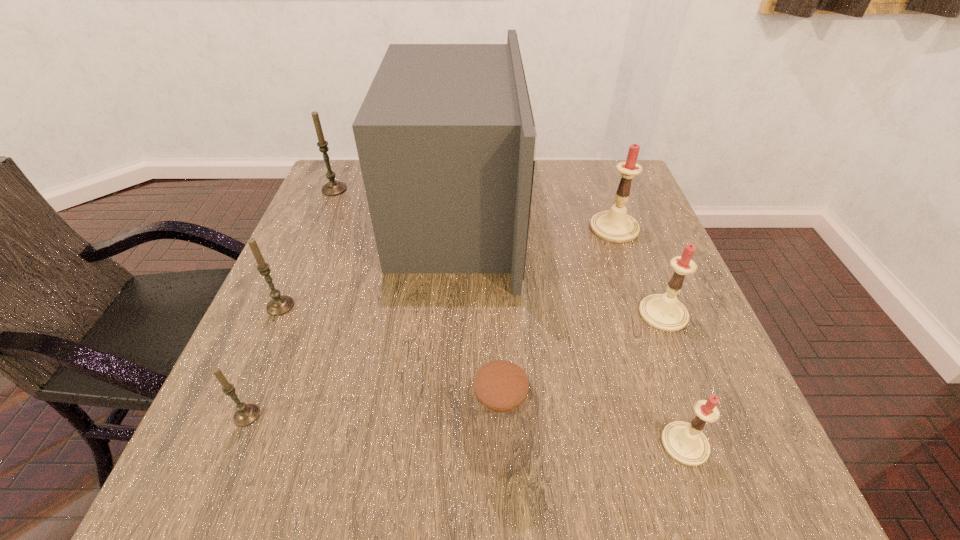
The width and height of the screenshot is (960, 540). What are the coordinates of `candle that stands as the closest to the microwave oven` in the screenshot? It's located at (332, 188).

Select which candle appears as the closest to the nearest red candle. Please provide its 2D coordinates. Your answer should be formatted as a tuple, i.e. [(x, y)], where the tuple contains the x and y coordinates of a point satisfying the conditions above.

[(664, 312)]

Find the location of a particular element. The image size is (960, 540). gray candle object that ranks as the second closest to the smallest gray candle is located at coordinates (332, 188).

Where is `gray candle that stands as the third closest to the microwave oven`? This screenshot has height=540, width=960. gray candle that stands as the third closest to the microwave oven is located at coordinates (246, 414).

Identify which red candle is located as the third nearest to the smallest gray candle. Please provide its 2D coordinates. Your answer should be formatted as a tuple, i.e. [(x, y)], where the tuple contains the x and y coordinates of a point satisfying the conditions above.

[(615, 225)]

Identify the location of the closest red candle to the second nearest red candle. (615, 225).

Where is `vacant space that satisfies the following two spatial constraints: 1. on the front-facing side of the tallest object; 2. on the right side of the smallest red candle`? The width and height of the screenshot is (960, 540). vacant space that satisfies the following two spatial constraints: 1. on the front-facing side of the tallest object; 2. on the right side of the smallest red candle is located at coordinates (443, 444).

Where is `blank space that satisfies the following two spatial constraints: 1. on the front-facing side of the gray microwave oven; 2. on the right side of the biggest red candle`? The width and height of the screenshot is (960, 540). blank space that satisfies the following two spatial constraints: 1. on the front-facing side of the gray microwave oven; 2. on the right side of the biggest red candle is located at coordinates (456, 228).

The width and height of the screenshot is (960, 540). What are the coordinates of `free space that satisfies the following two spatial constraints: 1. on the front-facing side of the fifth nearest candle; 2. on the left side of the gray microwave oven` in the screenshot? It's located at (456, 228).

This screenshot has width=960, height=540. Identify the location of free point that satisfies the following two spatial constraints: 1. on the back side of the second nearest red candle; 2. on the front-facing side of the tallest object. (624, 215).